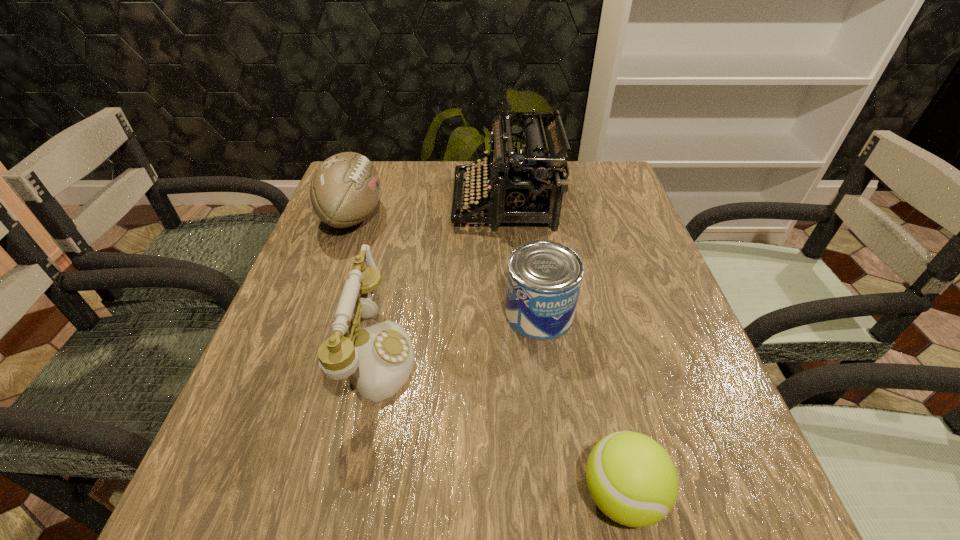
Locate an element on the screen. The width and height of the screenshot is (960, 540). typewriter that is at the far edge is located at coordinates (532, 181).

Where is `football (American) situated at the far edge`? This screenshot has height=540, width=960. football (American) situated at the far edge is located at coordinates (345, 189).

The height and width of the screenshot is (540, 960). In order to click on telephone located at the left edge in this screenshot , I will do `click(378, 360)`.

The width and height of the screenshot is (960, 540). Identify the location of football (American) present at the left edge. (345, 189).

Find the location of a particular element. The height and width of the screenshot is (540, 960). object located in the far left corner section of the desktop is located at coordinates click(345, 189).

The height and width of the screenshot is (540, 960). I want to click on vacant position at the left edge of the desktop, so click(324, 332).

Where is `vacant position at the right edge of the desktop`? vacant position at the right edge of the desktop is located at coordinates (614, 340).

At what (x,y) coordinates should I click in order to perform the action: click on vacant space at the far left corner. Please return your answer as a coordinate pair (x, y). The width and height of the screenshot is (960, 540). Looking at the image, I should click on (382, 180).

The height and width of the screenshot is (540, 960). In order to click on free space at the far right corner of the desktop in this screenshot , I will do `click(610, 186)`.

Find the location of a particular element. free space at the near right corner is located at coordinates (697, 478).